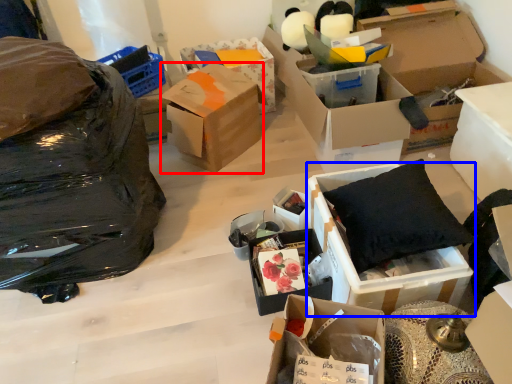
Question: Which of the following is the farthest to the observer, box (highlighted by a red box) or box (highlighted by a blue box)?

Choices:
 (A) box
 (B) box

Answer: (A)